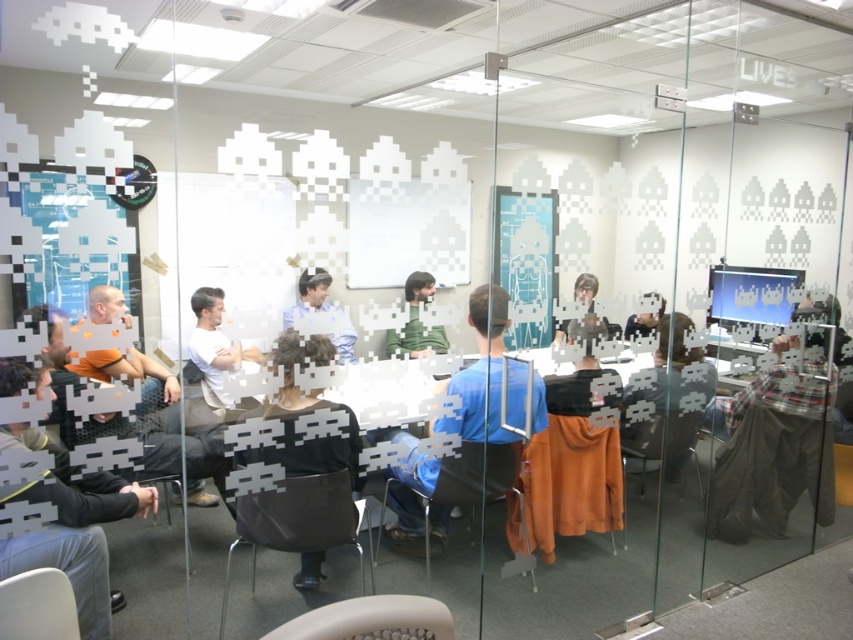
Between blue fabric shirt at center and white matte shirt at center, which one has less height?

white matte shirt at center is shorter.

Who is positioned more to the right, blue fabric shirt at center or white matte shirt at center?

blue fabric shirt at center is more to the right.

Identify the location of blue fabric shirt at center. (480, 372).

Between black matte jacket at center and green matte/soft shirt at center, which one appears on the right side from the viewer's perspective?

From the viewer's perspective, green matte/soft shirt at center appears more on the right side.

Can you confirm if black matte jacket at center is shorter than green matte/soft shirt at center?

No.

Is point (318, 444) more distant than point (410, 310)?

No, (318, 444) is in front of (410, 310).

Find the location of a particular element. The image size is (853, 640). black matte jacket at center is located at coordinates (305, 412).

Can you confirm if dark gray jeans at lower left is taller than blue fabric shirt at center?

Indeed, dark gray jeans at lower left has a greater height compared to blue fabric shirt at center.

Can you confirm if dark gray jeans at lower left is smaller than blue fabric shirt at center?

Indeed, dark gray jeans at lower left has a smaller size compared to blue fabric shirt at center.

Does point (67, 564) come closer to viewer compared to point (408, 536)?

Yes.

Where is `dark gray jeans at lower left`? Image resolution: width=853 pixels, height=640 pixels. dark gray jeans at lower left is located at coordinates (73, 528).